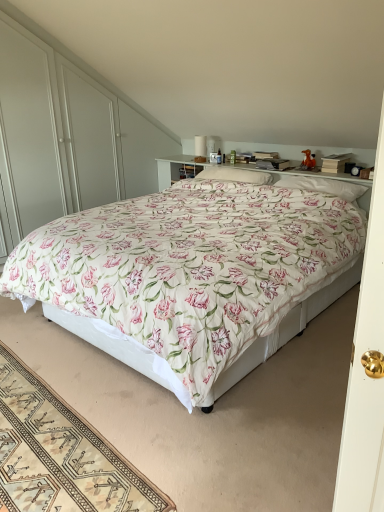
At what (x,y) coordinates should I click in order to perform the action: click on white glossy dresser at upper center. Please return your answer as a coordinate pair (x, y). Looking at the image, I should click on (65, 138).

Measure the distance between point (89, 477) and camera.

A distance of 5.63 feet exists between point (89, 477) and camera.

What are the coordinates of `white soft pillow at upper center, acting as the second pillow starting from the left` in the screenshot? It's located at (323, 186).

Is white glossy dresser at upper center taller than floral fabric bed at center?

Yes, white glossy dresser at upper center is taller than floral fabric bed at center.

Which object is thinner, white glossy dresser at upper center or floral fabric bed at center?

With smaller width is white glossy dresser at upper center.

How many degrees apart are the facing directions of white glossy dresser at upper center and floral fabric bed at center?

They differ by 83.9 degrees in their facing directions.

Between white glossy dresser at upper center and floral fabric bed at center, which one is positioned behind?

white glossy dresser at upper center is further from the camera.

Is white soft pillow at center, which ranks as the 2th pillow in right-to-left order, turned away from floral fabric bed at center?

Yes, white soft pillow at center, which ranks as the 2th pillow in right-to-left order, is positioned with its back facing floral fabric bed at center.

Is white soft pillow at center, which ranks as the 2th pillow in right-to-left order, not close to floral fabric bed at center?

white soft pillow at center, which ranks as the 2th pillow in right-to-left order, is positioned a significant distance from floral fabric bed at center.

Who is smaller, white soft pillow at center, which ranks as the 2th pillow in right-to-left order, or floral fabric bed at center?

white soft pillow at center, which ranks as the 2th pillow in right-to-left order, is smaller.

The width and height of the screenshot is (384, 512). I want to click on bed in front of the white soft pillow at center, which ranks as the 2th pillow in right-to-left order, so click(x=192, y=276).

From a real-world perspective, between white glossy dresser at upper center and white soft pillow at center, which ranks as the 2th pillow in right-to-left order, who is vertically higher?

In real-world perspective, white glossy dresser at upper center is above.

Based on their sizes in the image, would you say white glossy dresser at upper center is bigger or smaller than white soft pillow at center, the first pillow from the left?

white glossy dresser at upper center is bigger than white soft pillow at center, the first pillow from the left.

Identify the location of pillow that is the 1st object directly below the white glossy dresser at upper center (from a real-world perspective). Image resolution: width=384 pixels, height=512 pixels. (235, 175).

Who is more distant, white glossy dresser at upper center or white soft pillow at center, the first pillow from the left?

white soft pillow at center, the first pillow from the left, is behind.

Considering the sizes of white soft pillow at center, which ranks as the 2th pillow in right-to-left order, and white glossy dresser at upper center in the image, is white soft pillow at center, which ranks as the 2th pillow in right-to-left order, taller or shorter than white glossy dresser at upper center?

Considering their sizes, white soft pillow at center, which ranks as the 2th pillow in right-to-left order, has less height than white glossy dresser at upper center.

Considering their positions, is white soft pillow at center, the first pillow from the left, located in front of or behind white glossy dresser at upper center?

In the image, white soft pillow at center, the first pillow from the left, appears behind white glossy dresser at upper center.

Are white soft pillow at center, which ranks as the 2th pillow in right-to-left order, and white glossy dresser at upper center far apart?

Yes, white soft pillow at center, which ranks as the 2th pillow in right-to-left order, and white glossy dresser at upper center are quite far apart.

There is a white glossy dresser at upper center. Find the location of `the 1st pillow below it (from a real-world perspective)`. the 1st pillow below it (from a real-world perspective) is located at coordinates (235, 175).

From a real-world perspective, which pillow is the 2nd one above the floral fabric bed at center? Please provide its 2D coordinates.

[(235, 175)]

Considering the sizes of objects floral fabric bed at center and white soft pillow at center, which ranks as the 2th pillow in right-to-left order, in the image provided, who is bigger, floral fabric bed at center or white soft pillow at center, which ranks as the 2th pillow in right-to-left order,?

floral fabric bed at center.

Is white soft pillow at center, which ranks as the 2th pillow in right-to-left order, at the back of floral fabric bed at center?

No, floral fabric bed at center's orientation is not away from white soft pillow at center, which ranks as the 2th pillow in right-to-left order.

Is point (233, 193) in front of point (243, 176)?

Yes, point (233, 193) is in front of point (243, 176).

What's the angular difference between beige woven rug at lower left and white soft pillow at upper center, positioned as the 1th pillow in right-to-left order,'s facing directions?

86.9 degrees separate the facing orientations of beige woven rug at lower left and white soft pillow at upper center, positioned as the 1th pillow in right-to-left order.

From the image's perspective, count 1st pillows upward from the beige woven rug at lower left and point to it. Please provide its 2D coordinates.

[(323, 186)]

From a real-world perspective, is beige woven rug at lower left above or below white soft pillow at upper center, positioned as the 1th pillow in right-to-left order?

Clearly, from a real-world perspective, beige woven rug at lower left is below white soft pillow at upper center, positioned as the 1th pillow in right-to-left order.

Looking at this image, is beige woven rug at lower left bigger than white soft pillow at upper center, acting as the second pillow starting from the left?

Yes.

From a real-world perspective, relative to beige woven rug at lower left, is white soft pillow at upper center, acting as the second pillow starting from the left, vertically above or below?

Clearly, from a real-world perspective, white soft pillow at upper center, acting as the second pillow starting from the left, is above beige woven rug at lower left.

Considering the sizes of white soft pillow at upper center, positioned as the 1th pillow in right-to-left order, and beige woven rug at lower left in the image, is white soft pillow at upper center, positioned as the 1th pillow in right-to-left order, wider or thinner than beige woven rug at lower left?

white soft pillow at upper center, positioned as the 1th pillow in right-to-left order, is thinner than beige woven rug at lower left.

Which object is further away from the camera taking this photo, white soft pillow at upper center, acting as the second pillow starting from the left, or beige woven rug at lower left?

Positioned behind is white soft pillow at upper center, acting as the second pillow starting from the left.

Is white soft pillow at upper center, positioned as the 1th pillow in right-to-left order, not close to beige woven rug at lower left?

Yes.

The width and height of the screenshot is (384, 512). In order to click on bed that is in front of the white glossy dresser at upper center in this screenshot , I will do `click(192, 276)`.

What are the coordinates of `bed on the left side of white soft pillow at center, the first pillow from the left` in the screenshot? It's located at (192, 276).

From the picture: Looking at the image, which one is located closer to white glossy dresser at upper center, white soft pillow at center, which ranks as the 2th pillow in right-to-left order, or white soft pillow at upper center, acting as the second pillow starting from the left?

The object closer to white glossy dresser at upper center is white soft pillow at center, which ranks as the 2th pillow in right-to-left order.

Based on their spatial positions, is floral fabric bed at center or beige woven rug at lower left further from white soft pillow at center, which ranks as the 2th pillow in right-to-left order?

beige woven rug at lower left.

In the scene shown: Considering their positions, is white glossy dresser at upper center positioned further to beige woven rug at lower left than white soft pillow at upper center, acting as the second pillow starting from the left?

Among the two, white glossy dresser at upper center is located further to beige woven rug at lower left.

Based on their spatial positions, is beige woven rug at lower left or white soft pillow at center, which ranks as the 2th pillow in right-to-left order, further from floral fabric bed at center?

white soft pillow at center, which ranks as the 2th pillow in right-to-left order, is positioned further to the anchor floral fabric bed at center.

Looking at this image, when comparing their distances from beige woven rug at lower left, does floral fabric bed at center or white soft pillow at upper center, acting as the second pillow starting from the left, seem closer?

floral fabric bed at center lies closer to beige woven rug at lower left than the other object.

When comparing their distances from white glossy dresser at upper center, does beige woven rug at lower left or floral fabric bed at center seem closer?

Among the two, floral fabric bed at center is located nearer to white glossy dresser at upper center.

In the scene shown: Looking at the image, which one is located closer to white soft pillow at upper center, acting as the second pillow starting from the left, white soft pillow at center, the first pillow from the left, or white glossy dresser at upper center?

Among the two, white soft pillow at center, the first pillow from the left, is located nearer to white soft pillow at upper center, acting as the second pillow starting from the left.

Which object lies further to the anchor point floral fabric bed at center, white glossy dresser at upper center or beige woven rug at lower left?

white glossy dresser at upper center is further to floral fabric bed at center.

You are a GUI agent. You are given a task and a screenshot of the screen. Output one action in this format:
    pyautogui.click(x=<x>, y=<y>)
    Task: Click on the pillow between white glossy dresser at upper center and white soft pillow at upper center, acting as the second pillow starting from the left, in the horizontal direction
    
    Given the screenshot: What is the action you would take?
    pyautogui.click(x=235, y=175)

Identify the location of dresser between beige woven rug at lower left and white soft pillow at center, which ranks as the 2th pillow in right-to-left order, from front to back. (65, 138).

Locate an element on the screen. This screenshot has height=512, width=384. bed between beige woven rug at lower left and white soft pillow at upper center, positioned as the 1th pillow in right-to-left order, in the front-back direction is located at coordinates (192, 276).

Locate an element on the screen. The width and height of the screenshot is (384, 512). pillow positioned between beige woven rug at lower left and white soft pillow at center, which ranks as the 2th pillow in right-to-left order, from near to far is located at coordinates (323, 186).